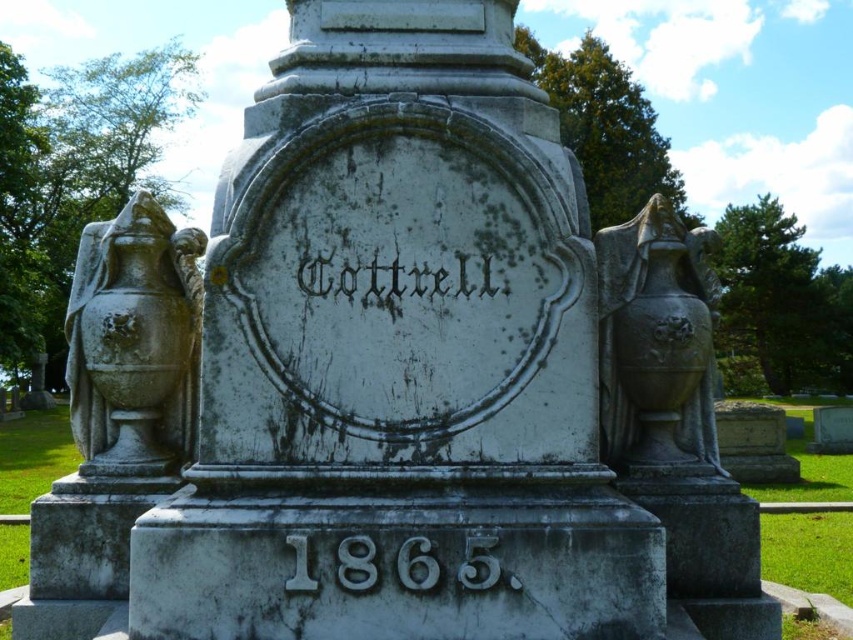
Question: Which point is farther from the camera taking this photo?

Choices:
 (A) (709, 461)
 (B) (428, 563)
 (C) (158, 470)

Answer: (A)

Question: Is gray stone urn at right to the right of black stone text at center from the viewer's perspective?

Choices:
 (A) no
 (B) yes

Answer: (B)

Question: Estimate the real-world distances between objects in this image. Which object is closer to the gray stone urn at right?

Choices:
 (A) black stone text at center
 (B) gray stone urn at left

Answer: (A)

Question: Observing the image, what is the correct spatial positioning of gray stone/texture year at lower center in reference to black stone text at center?

Choices:
 (A) above
 (B) below

Answer: (B)

Question: Which of the following is the closest to the observer?

Choices:
 (A) (86, 320)
 (B) (619, 278)
 (C) (335, 289)

Answer: (C)

Question: Does gray stone urn at right have a smaller size compared to gray stone/texture year at lower center?

Choices:
 (A) no
 (B) yes

Answer: (A)